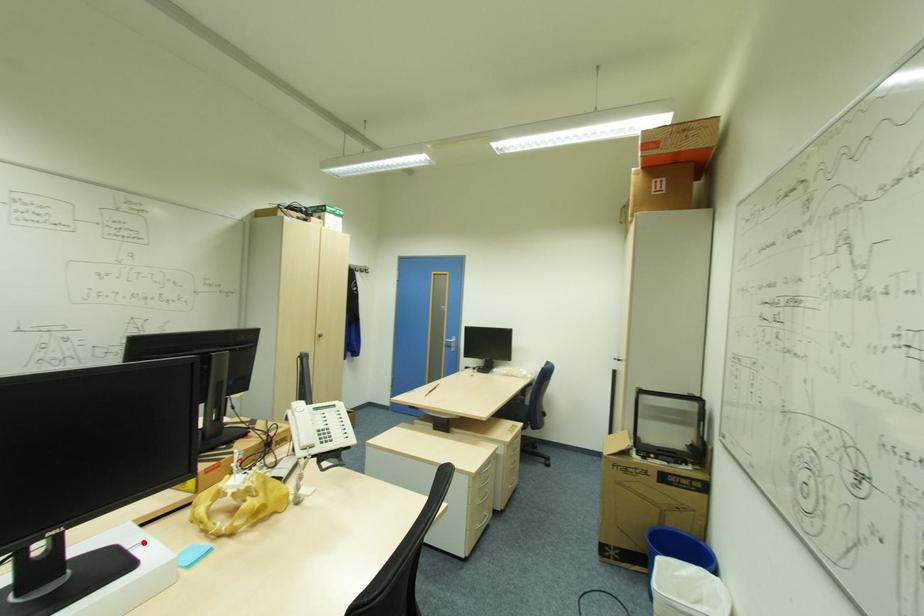
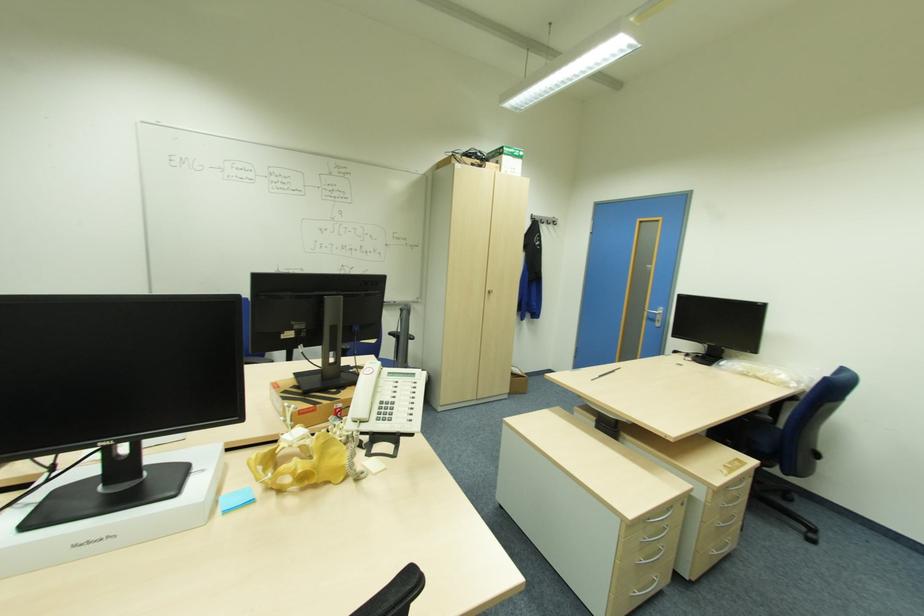
Find the pixel in the second image that matches the highlighted location in the first image.

(207, 469)